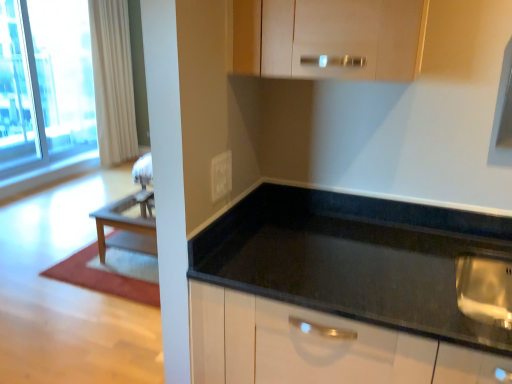
Question: From the image's perspective, is transparent glass window at upper left positioned above or below black granite countertop at center?

Choices:
 (A) above
 (B) below

Answer: (A)

Question: Considering the positions of point (74, 94) and point (328, 201), is point (74, 94) closer or farther from the camera than point (328, 201)?

Choices:
 (A) farther
 (B) closer

Answer: (A)

Question: Considering the real-world distances, which object is closest to the black granite countertop at center?

Choices:
 (A) transparent glass window at upper left
 (B) matte wood cabinet at upper center
 (C) white glossy electric outlet at center
 (D) white textured curtain at left

Answer: (C)

Question: Considering the real-world distances, which object is farthest from the matte wood cabinet at upper center?

Choices:
 (A) black granite countertop at center
 (B) white textured curtain at left
 (C) white glossy electric outlet at center
 (D) transparent glass window at upper left

Answer: (D)